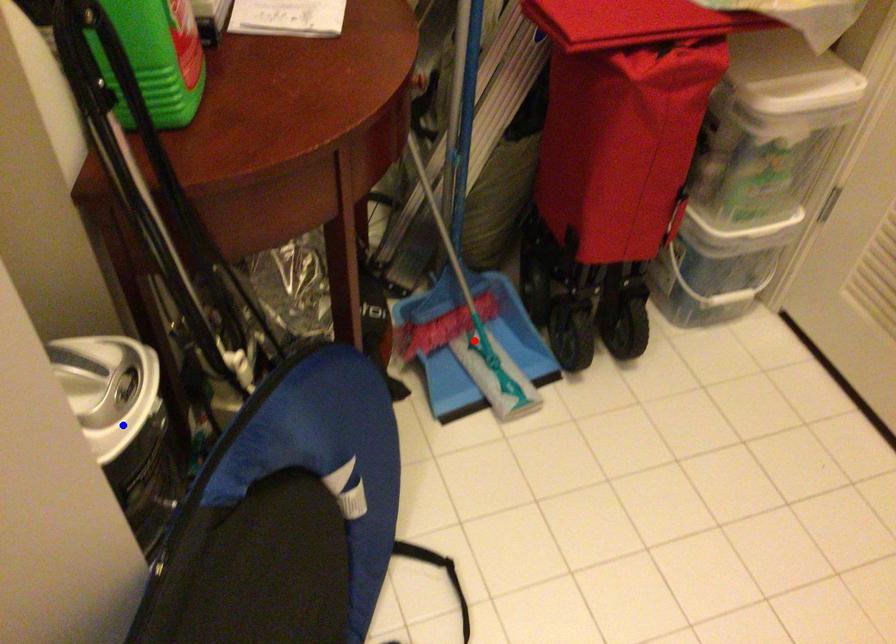
Question: In the image, two points are highlighted. Which point is nearer to the camera? Reply with the corresponding letter.

Choices:
 (A) blue point
 (B) red point

Answer: (A)